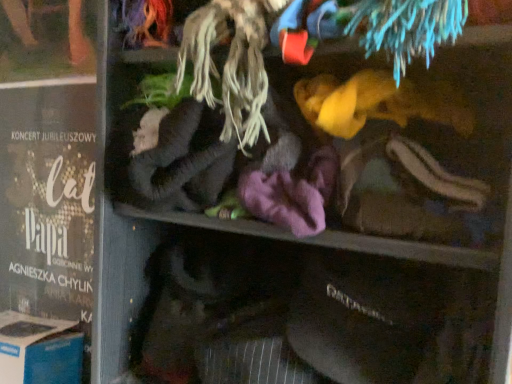
Question: From the image's perspective, is matte black poster at left located above or below blue cardboard box at lower left?

Choices:
 (A) above
 (B) below

Answer: (A)

Question: Is matte black poster at left to the left or to the right of blue cardboard box at lower left in the image?

Choices:
 (A) right
 (B) left

Answer: (A)

Question: Considering the positions of point (24, 11) and point (5, 342), is point (24, 11) closer or farther from the camera than point (5, 342)?

Choices:
 (A) farther
 (B) closer

Answer: (A)

Question: Which is correct: blue cardboard box at lower left is inside matte black poster at left, or outside of it?

Choices:
 (A) outside
 (B) inside

Answer: (A)

Question: From a real-world perspective, is blue cardboard box at lower left above or below matte black poster at left?

Choices:
 (A) below
 (B) above

Answer: (A)

Question: Considering their positions, is blue cardboard box at lower left located in front of or behind matte black poster at left?

Choices:
 (A) behind
 (B) front

Answer: (B)

Question: Looking at the image, does blue cardboard box at lower left seem bigger or smaller compared to matte black poster at left?

Choices:
 (A) big
 (B) small

Answer: (A)